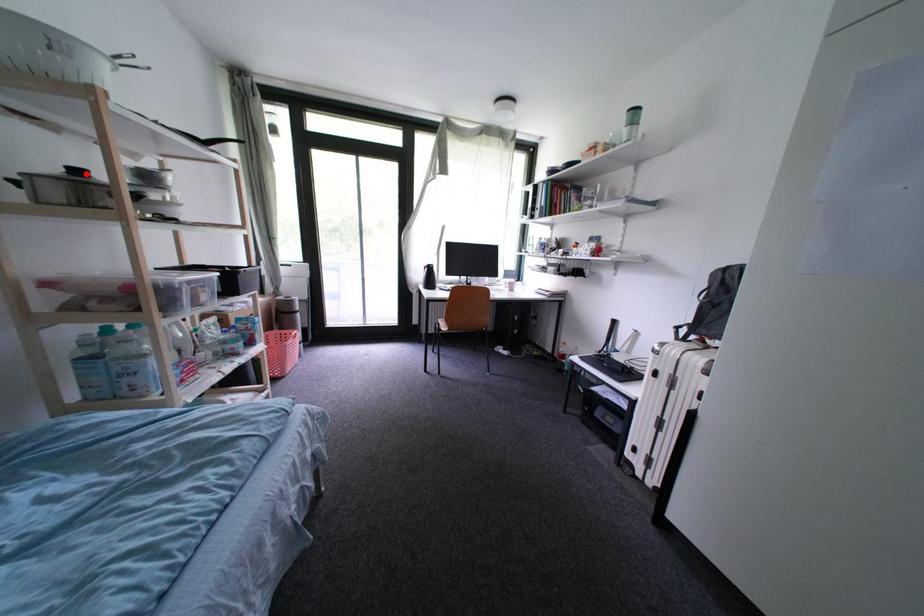
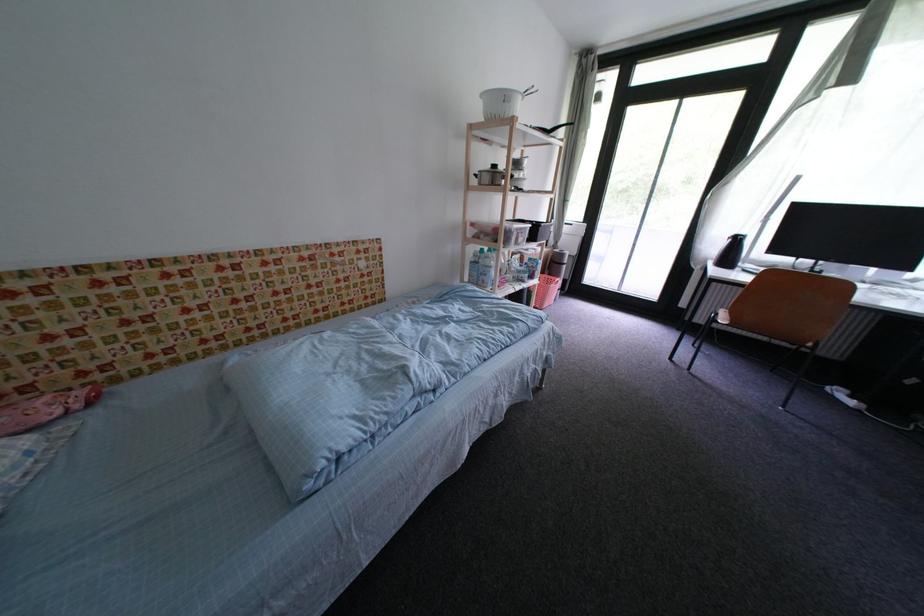
Question: I am providing you with two images of the same scene from different viewpoints. Given a red point in image1, look at the same physical point in image2. Is it:

Choices:
 (A) Closer to the viewpoint
 (B) Farther from the viewpoint

Answer: (A)